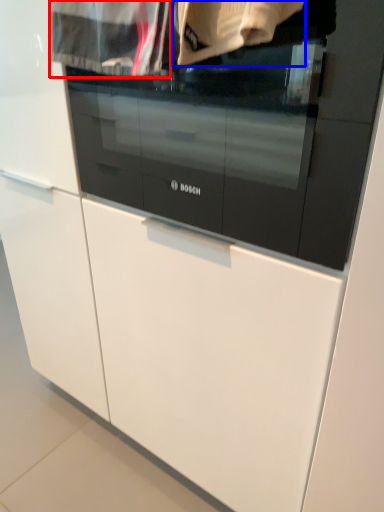
Question: Which object is further to the camera taking this photo, clothing (highlighted by a red box) or clothing (highlighted by a blue box)?

Choices:
 (A) clothing
 (B) clothing

Answer: (A)